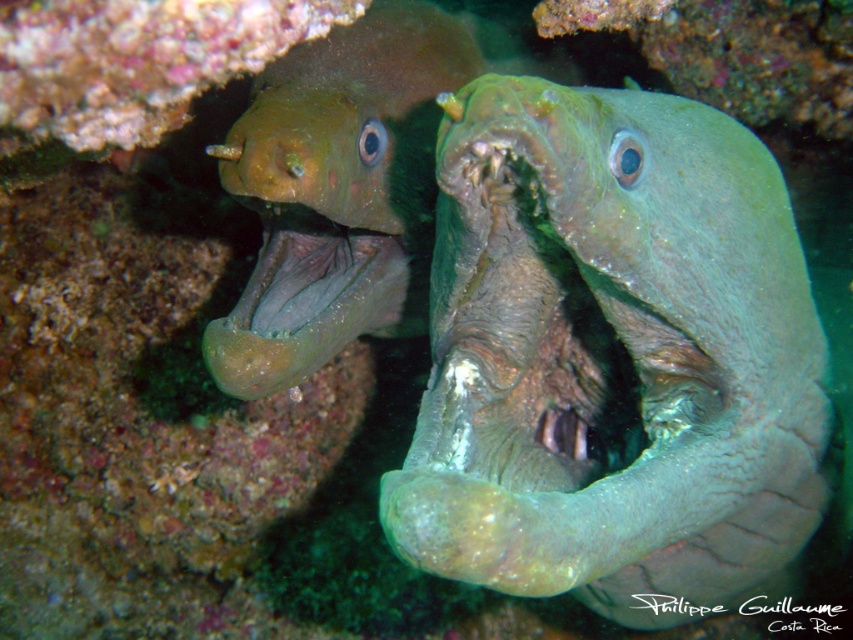
You are a marine biologist observing two moray eels underwater. You notice the green rough skin at center and the green matte moray eel at upper left. Which of these has a wider body?

The green rough skin at center has a wider body than the green matte moray eel at upper left.